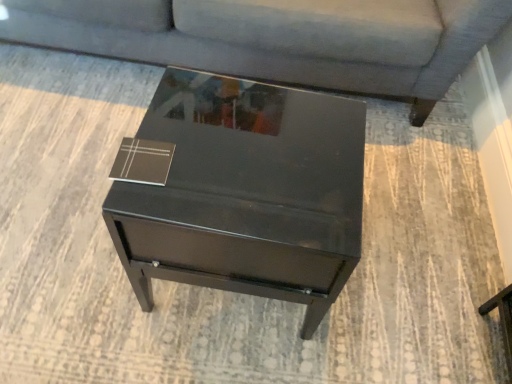
Question: Should I look upward or downward to see matte gray couch at upper center?

Choices:
 (A) up
 (B) down

Answer: (A)

Question: Does matte gray couch at upper center turn towards glossy black table at center?

Choices:
 (A) no
 (B) yes

Answer: (B)

Question: Is matte gray couch at upper center looking in the opposite direction of glossy black table at center?

Choices:
 (A) yes
 (B) no

Answer: (B)

Question: Is matte gray couch at upper center further to the viewer compared to glossy black table at center?

Choices:
 (A) no
 (B) yes

Answer: (B)

Question: Are matte gray couch at upper center and glossy black table at center located far from each other?

Choices:
 (A) no
 (B) yes

Answer: (A)

Question: Is matte gray couch at upper center thinner than glossy black table at center?

Choices:
 (A) yes
 (B) no

Answer: (B)

Question: From a real-world perspective, is matte gray couch at upper center physically below glossy black table at center?

Choices:
 (A) yes
 (B) no

Answer: (B)

Question: From the image's perspective, does brown leather book at upper left appear lower than glossy black table at center?

Choices:
 (A) yes
 (B) no

Answer: (B)

Question: From a real-world perspective, is brown leather book at upper left physically below glossy black table at center?

Choices:
 (A) yes
 (B) no

Answer: (B)

Question: Is brown leather book at upper left located outside glossy black table at center?

Choices:
 (A) no
 (B) yes

Answer: (B)

Question: Can you confirm if brown leather book at upper left is thinner than glossy black table at center?

Choices:
 (A) no
 (B) yes

Answer: (B)

Question: Is glossy black table at center at the back of brown leather book at upper left?

Choices:
 (A) no
 (B) yes

Answer: (A)

Question: Can you confirm if brown leather book at upper left is smaller than glossy black table at center?

Choices:
 (A) yes
 (B) no

Answer: (A)

Question: Can you confirm if matte gray couch at upper center is wider than brown leather book at upper left?

Choices:
 (A) no
 (B) yes

Answer: (B)